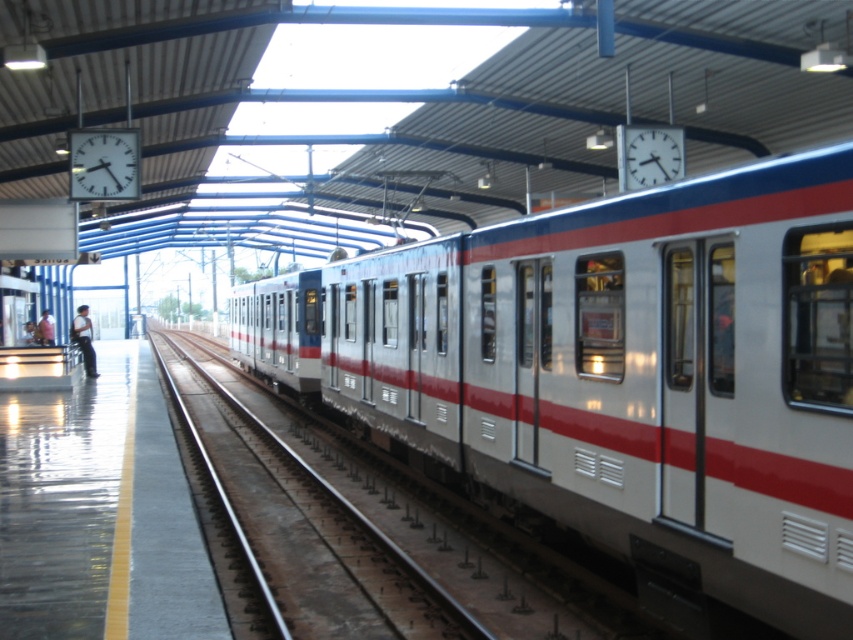
Between silver metallic train at center and metallic track at center, which one is positioned lower?

metallic track at center

Describe the element at coordinates (621, 372) in the screenshot. I see `silver metallic train at center` at that location.

You are a GUI agent. You are given a task and a screenshot of the screen. Output one action in this format:
    pyautogui.click(x=<x>, y=<y>)
    Task: Click on the silver metallic train at center
    The width and height of the screenshot is (853, 640).
    Given the screenshot: What is the action you would take?
    pyautogui.click(x=621, y=372)

Does silver metallic train at center appear over light pink shirt at left?

Incorrect, silver metallic train at center is not positioned above light pink shirt at left.

Who is more forward, (595, 337) or (39, 332)?

Point (595, 337) is in front.

The image size is (853, 640). I want to click on silver metallic train at center, so click(x=621, y=372).

You are a GUI agent. You are given a task and a screenshot of the screen. Output one action in this format:
    pyautogui.click(x=<x>, y=<y>)
    Task: Click on the silver metallic train at center
    
    Given the screenshot: What is the action you would take?
    pyautogui.click(x=621, y=372)

Does metallic track at center have a larger size compared to light blue jeans at left?

Yes.

Can you confirm if metallic track at center is smaller than light blue jeans at left?

No.

The height and width of the screenshot is (640, 853). What are the coordinates of `metallic track at center` in the screenshot? It's located at (323, 538).